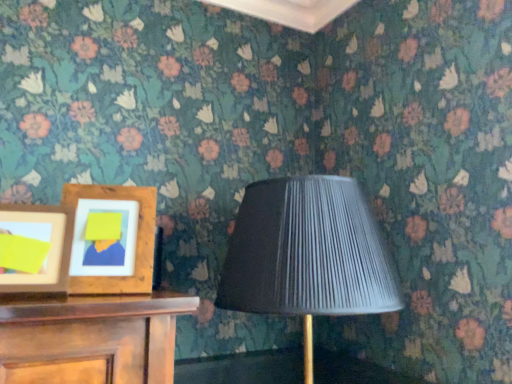
What do you see at coordinates (307, 254) in the screenshot? I see `matte black lampshade at center` at bounding box center [307, 254].

This screenshot has height=384, width=512. I want to click on wooden picture frame at left, the second picture frame viewed from the right, so click(35, 248).

Locate an element on the screen. The width and height of the screenshot is (512, 384). wooden picture frame at left, placed as the 2th picture frame when sorted from left to right is located at coordinates (112, 239).

In terms of width, does wooden picture frame at left, the first picture frame in the right-to-left sequence, look wider or thinner when compared to wooden picture frame at left, which ranks as the first picture frame in left-to-right order?

Considering their sizes, wooden picture frame at left, the first picture frame in the right-to-left sequence, looks broader than wooden picture frame at left, which ranks as the first picture frame in left-to-right order.

How different are the orientations of wooden picture frame at left, placed as the 2th picture frame when sorted from left to right, and wooden picture frame at left, the second picture frame viewed from the right, in degrees?

The angular difference between wooden picture frame at left, placed as the 2th picture frame when sorted from left to right, and wooden picture frame at left, the second picture frame viewed from the right, is 4.36 degrees.

At what (x,y) coordinates should I click in order to perform the action: click on picture frame located behind the wooden picture frame at left, the second picture frame viewed from the right. Please return your answer as a coordinate pair (x, y). The height and width of the screenshot is (384, 512). Looking at the image, I should click on (112, 239).

Considering the relative positions of wooden picture frame at left, the first picture frame in the right-to-left sequence, and wooden picture frame at left, the second picture frame viewed from the right, in the image provided, is wooden picture frame at left, the first picture frame in the right-to-left sequence, behind wooden picture frame at left, the second picture frame viewed from the right,?

That is True.

Locate an element on the screen. The width and height of the screenshot is (512, 384). lamp in front of the wooden picture frame at left, placed as the 2th picture frame when sorted from left to right is located at coordinates (307, 254).

Is wooden picture frame at left, placed as the 2th picture frame when sorted from left to right, bigger than matte black lampshade at center?

No.

Considering the sizes of objects wooden picture frame at left, the first picture frame in the right-to-left sequence, and matte black lampshade at center in the image provided, who is shorter, wooden picture frame at left, the first picture frame in the right-to-left sequence, or matte black lampshade at center?

wooden picture frame at left, the first picture frame in the right-to-left sequence, is shorter.

Considering the sizes of objects matte black lampshade at center and wooden picture frame at left, placed as the 2th picture frame when sorted from left to right, in the image provided, who is thinner, matte black lampshade at center or wooden picture frame at left, placed as the 2th picture frame when sorted from left to right,?

With smaller width is wooden picture frame at left, placed as the 2th picture frame when sorted from left to right.

Is matte black lampshade at center taller than wooden picture frame at left, the first picture frame in the right-to-left sequence?

Yes, matte black lampshade at center is taller than wooden picture frame at left, the first picture frame in the right-to-left sequence.

Consider the image. From the image's perspective, is matte black lampshade at center above or below wooden picture frame at left, placed as the 2th picture frame when sorted from left to right?

Based on their image positions, matte black lampshade at center is located beneath wooden picture frame at left, placed as the 2th picture frame when sorted from left to right.

From a real-world perspective, is matte black lampshade at center under wooden picture frame at left, placed as the 2th picture frame when sorted from left to right?

Indeed, from a real-world perspective, matte black lampshade at center is positioned beneath wooden picture frame at left, placed as the 2th picture frame when sorted from left to right.

Which of these two, matte black lampshade at center or wooden picture frame at left, the second picture frame viewed from the right, stands taller?

matte black lampshade at center is taller.

From the image's perspective, who appears lower, matte black lampshade at center or wooden picture frame at left, the second picture frame viewed from the right?

matte black lampshade at center, from the image's perspective.

Is point (272, 254) less distant than point (41, 285)?

No, it is behind (41, 285).

From a real-world perspective, is matte black lampshade at center positioned over wooden picture frame at left, the second picture frame viewed from the right, based on gravity?

Actually, matte black lampshade at center is physically below wooden picture frame at left, the second picture frame viewed from the right, in the real world.

In terms of size, does wooden picture frame at left, which ranks as the first picture frame in left-to-right order, appear bigger or smaller than wooden picture frame at left, the first picture frame in the right-to-left sequence?

In the image, wooden picture frame at left, which ranks as the first picture frame in left-to-right order, appears to be smaller than wooden picture frame at left, the first picture frame in the right-to-left sequence.

Which is behind, point (64, 208) or point (88, 207)?

The point (88, 207) is behind.

From the image's perspective, is wooden picture frame at left, the second picture frame viewed from the right, on top of wooden picture frame at left, placed as the 2th picture frame when sorted from left to right?

Yes.

Is wooden picture frame at left, which ranks as the first picture frame in left-to-right order, bigger than matte black lampshade at center?

No.

Which of these two, wooden picture frame at left, which ranks as the first picture frame in left-to-right order, or matte black lampshade at center, stands taller?

With more height is matte black lampshade at center.

Which point is more distant from viewer, (46, 257) or (279, 236)?

Point (279, 236)

The image size is (512, 384). Find the location of `picture frame below the wooden picture frame at left, which ranks as the first picture frame in left-to-right order (from the image's perspective)`. picture frame below the wooden picture frame at left, which ranks as the first picture frame in left-to-right order (from the image's perspective) is located at coordinates (112, 239).

At what (x,y) coordinates should I click in order to perform the action: click on the 1st picture frame above when counting from the matte black lampshade at center (from the image's perspective). Please return your answer as a coordinate pair (x, y). This screenshot has height=384, width=512. Looking at the image, I should click on (112, 239).

When comparing their distances from matte black lampshade at center, does wooden picture frame at left, which ranks as the first picture frame in left-to-right order, or wooden picture frame at left, the first picture frame in the right-to-left sequence, seem closer?

wooden picture frame at left, the first picture frame in the right-to-left sequence, is closer to matte black lampshade at center.

Estimate the real-world distances between objects in this image. Which object is closer to wooden picture frame at left, the second picture frame viewed from the right, wooden picture frame at left, the first picture frame in the right-to-left sequence, or matte black lampshade at center?

Among the two, wooden picture frame at left, the first picture frame in the right-to-left sequence, is located nearer to wooden picture frame at left, the second picture frame viewed from the right.

From the image, which object appears to be farther from wooden picture frame at left, which ranks as the first picture frame in left-to-right order, matte black lampshade at center or wooden picture frame at left, placed as the 2th picture frame when sorted from left to right?

The object further to wooden picture frame at left, which ranks as the first picture frame in left-to-right order, is matte black lampshade at center.

Based on their spatial positions, is matte black lampshade at center or wooden picture frame at left, the second picture frame viewed from the right, further from wooden picture frame at left, placed as the 2th picture frame when sorted from left to right?

matte black lampshade at center.

Looking at the image, which one is located closer to wooden picture frame at left, placed as the 2th picture frame when sorted from left to right, wooden picture frame at left, which ranks as the first picture frame in left-to-right order, or matte black lampshade at center?

The object closer to wooden picture frame at left, placed as the 2th picture frame when sorted from left to right, is wooden picture frame at left, which ranks as the first picture frame in left-to-right order.

When comparing their distances from matte black lampshade at center, does wooden picture frame at left, placed as the 2th picture frame when sorted from left to right, or wooden picture frame at left, the second picture frame viewed from the right, seem further?

Based on the image, wooden picture frame at left, the second picture frame viewed from the right, appears to be further to matte black lampshade at center.

Find the location of `picture frame located between wooden picture frame at left, the second picture frame viewed from the right, and matte black lampshade at center in the left-right direction`. picture frame located between wooden picture frame at left, the second picture frame viewed from the right, and matte black lampshade at center in the left-right direction is located at coordinates (112, 239).